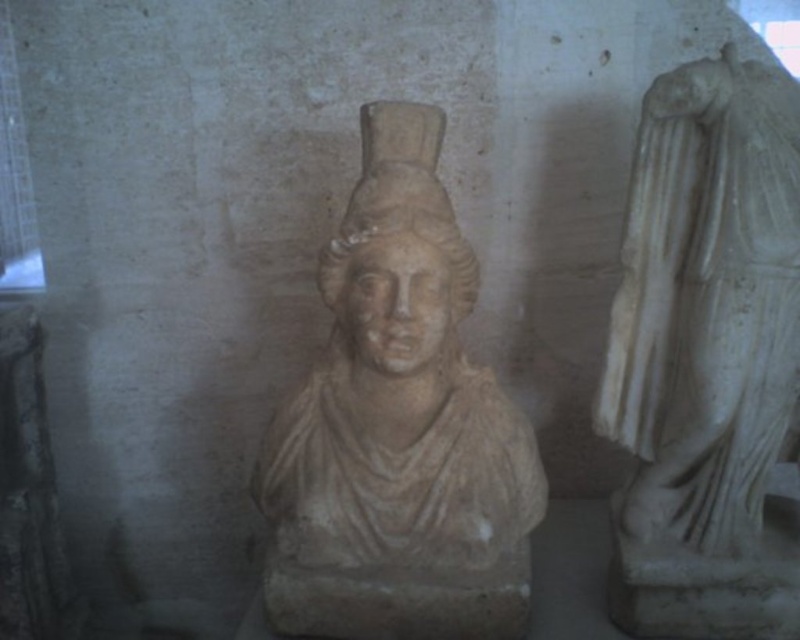
In the scene shown: Can you confirm if beige stone bust at center is positioned to the right of white stone bust at center?

In fact, beige stone bust at center is to the left of white stone bust at center.

This screenshot has height=640, width=800. I want to click on beige stone bust at center, so click(x=398, y=428).

Locate an element on the screen. beige stone bust at center is located at coordinates (398, 428).

Can you confirm if white marble statue at right is smaller than white stone bust at center?

No.

Does white marble statue at right come in front of white stone bust at center?

Yes.

Between point (616, 387) and point (449, 220), which one is positioned behind?

The point (616, 387) is behind.

Image resolution: width=800 pixels, height=640 pixels. In order to click on white marble statue at right in this screenshot , I will do `click(708, 355)`.

Is point (416, 545) closer to camera compared to point (700, 330)?

No, it is not.

Who is more forward, (480,538) or (740,536)?

Positioned in front is point (480,538).

Find the location of a particular element. beige stone bust at center is located at coordinates (398, 428).